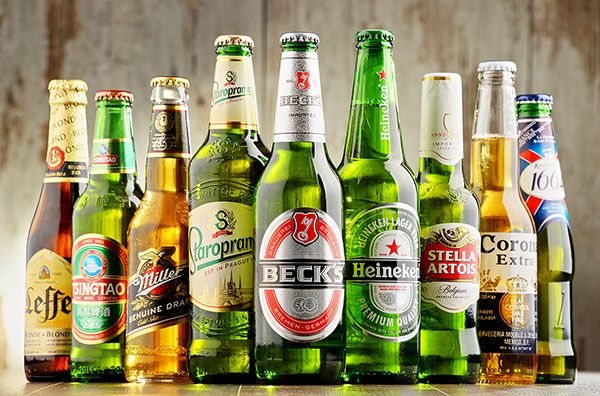
This screenshot has height=396, width=600. What are the coordinates of `beer bottles` in the screenshot? It's located at (49, 276), (94, 274), (151, 277), (214, 272), (289, 264), (378, 264), (450, 272), (510, 272), (553, 272).